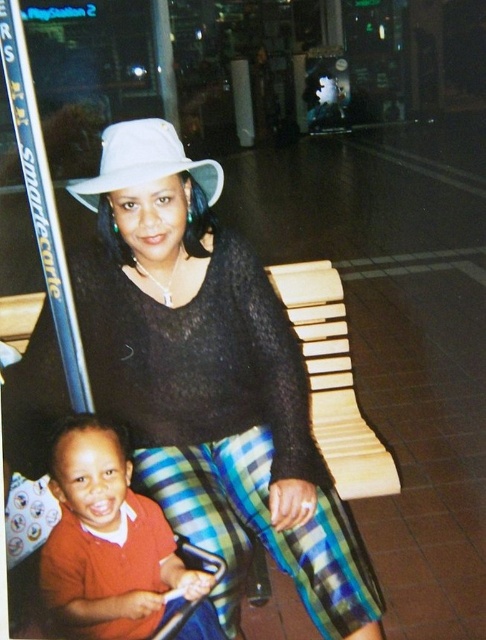
Question: Does matte orange shirt at lower left have a lesser width compared to white matte baseball hat at upper center?

Choices:
 (A) no
 (B) yes

Answer: (B)

Question: Which point is closer to the camera?

Choices:
 (A) white matte baseball hat at upper center
 (B) matte orange shirt at lower left
 (C) matte black sweater at center

Answer: (B)

Question: Can you confirm if matte orange shirt at lower left is positioned to the left of white matte baseball hat at upper center?

Choices:
 (A) yes
 (B) no

Answer: (B)

Question: Does matte orange shirt at lower left appear over white matte baseball hat at upper center?

Choices:
 (A) yes
 (B) no

Answer: (B)

Question: Which of these objects is positioned closest to the matte black sweater at center?

Choices:
 (A) white matte baseball hat at upper center
 (B) matte orange shirt at lower left

Answer: (B)

Question: Which of these objects is positioned farthest from the matte black sweater at center?

Choices:
 (A) white matte baseball hat at upper center
 (B) matte orange shirt at lower left

Answer: (A)